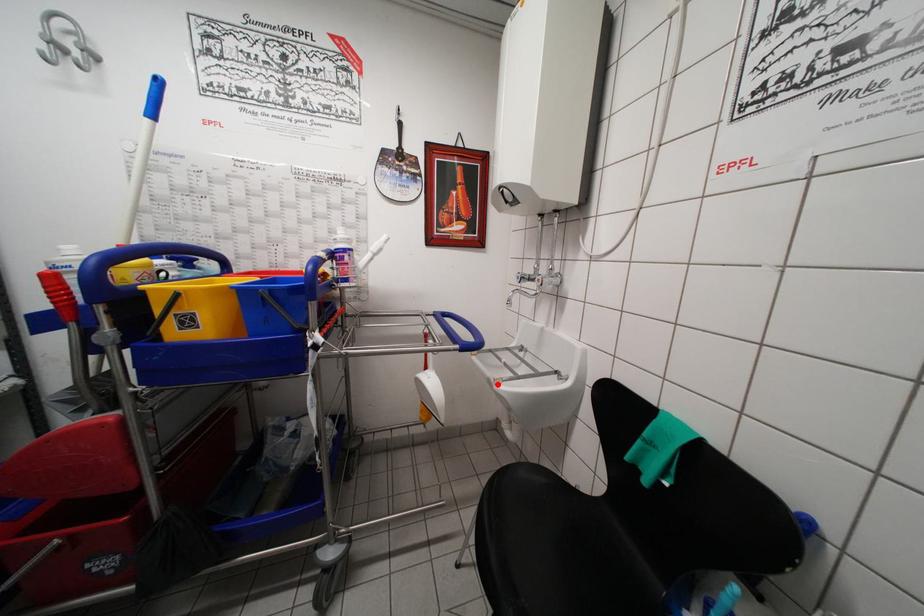
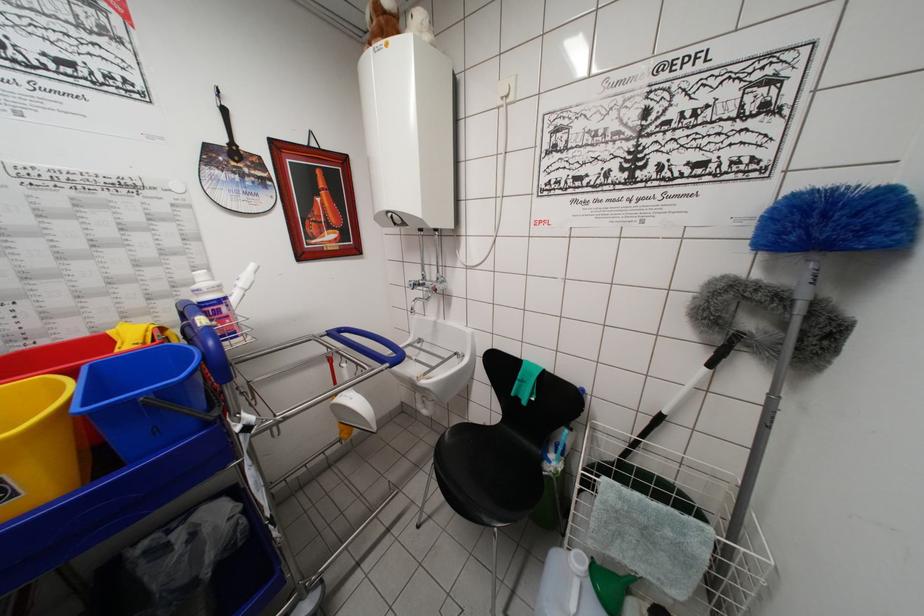
Question: I am providing you with two images of the same scene from different viewpoints. A red point is marked on the first image. Is the red point's position out of view in image 2?

Choices:
 (A) Yes
 (B) No

Answer: (B)